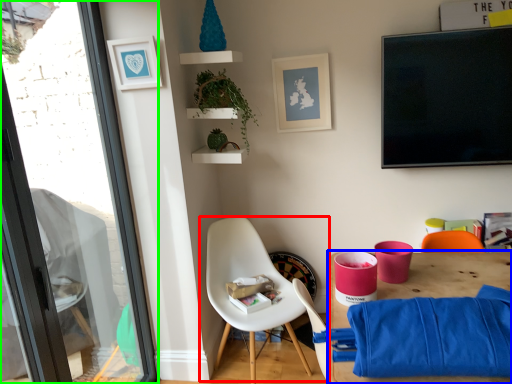
Question: Based on their relative distances, which object is nearer to chair (highlighted by a red box)? Choose from desk (highlighted by a blue box) and window (highlighted by a green box).

Choices:
 (A) desk
 (B) window

Answer: (A)